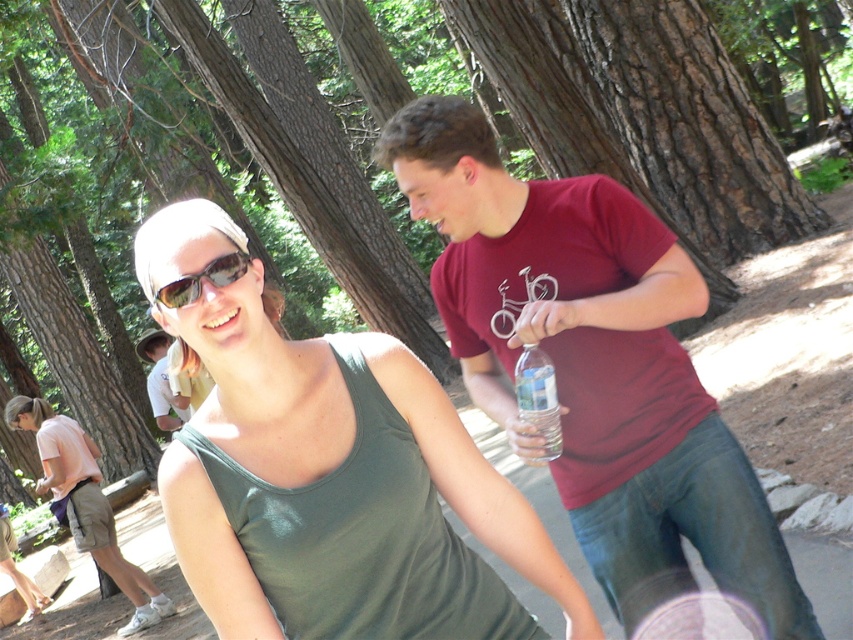
In the scene shown: Does green matte tank top at center come behind clear plastic bottle at center?

No, it is not.

Image resolution: width=853 pixels, height=640 pixels. What do you see at coordinates (340, 490) in the screenshot?
I see `green matte tank top at center` at bounding box center [340, 490].

Which is behind, point (238, 323) or point (518, 404)?

Point (518, 404)

What are the coordinates of `green matte tank top at center` in the screenshot? It's located at (340, 490).

Is point (251, 372) more distant than point (84, 484)?

No, (251, 372) is closer to viewer.

Where is `green matte tank top at center`? green matte tank top at center is located at coordinates (340, 490).

Does clear plastic bottle at center have a larger size compared to sunglasses at center?

Correct, clear plastic bottle at center is larger in size than sunglasses at center.

Can you confirm if clear plastic bottle at center is positioned above sunglasses at center?

Incorrect, clear plastic bottle at center is not positioned above sunglasses at center.

Is point (543, 424) positioned after point (225, 284)?

Yes, it is behind point (225, 284).

Locate an element on the screen. clear plastic bottle at center is located at coordinates (538, 397).